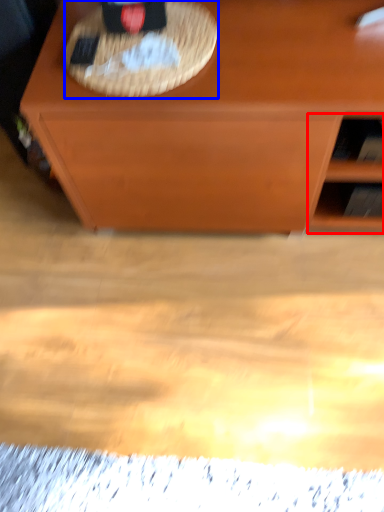
Question: Which object is further to the camera taking this photo, shelf (highlighted by a red box) or picnic basket (highlighted by a blue box)?

Choices:
 (A) shelf
 (B) picnic basket

Answer: (A)